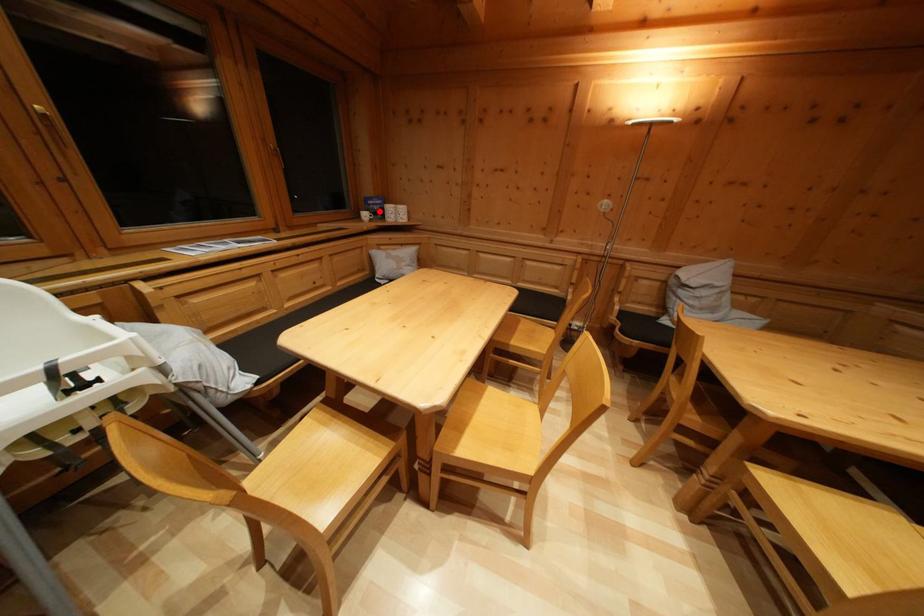
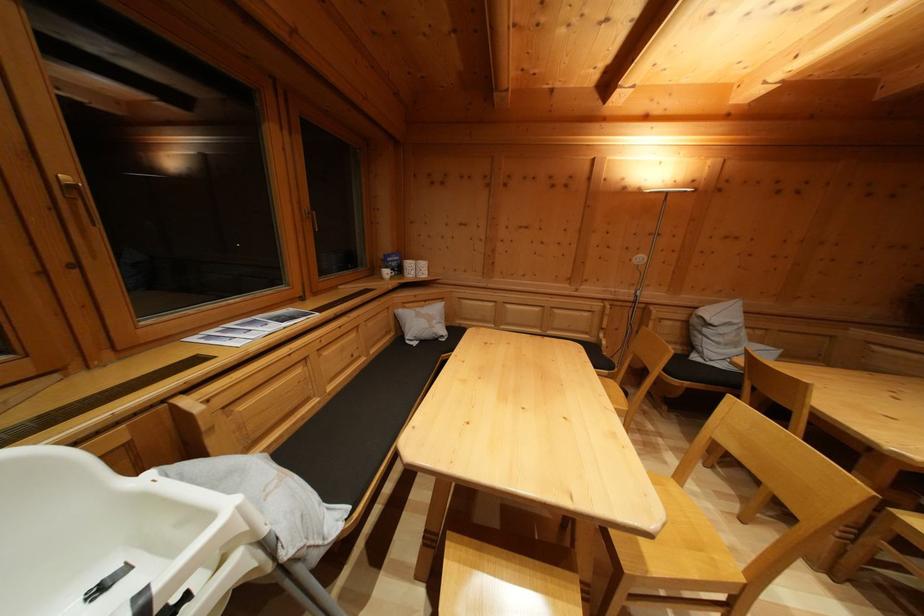
In the second image, find the point that corresponds to the highlighted location in the first image.

(397, 268)